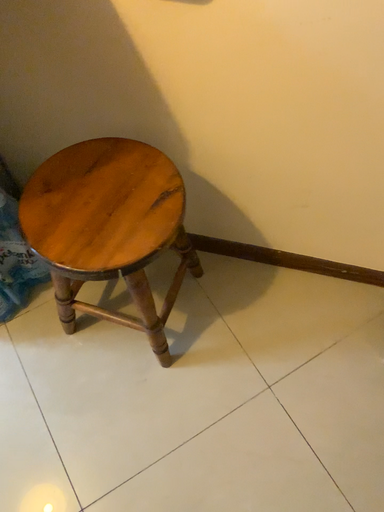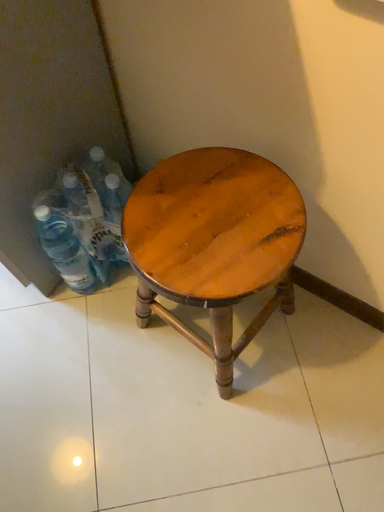
Question: Which way did the camera rotate in the video?

Choices:
 (A) rotated right
 (B) rotated left

Answer: (B)